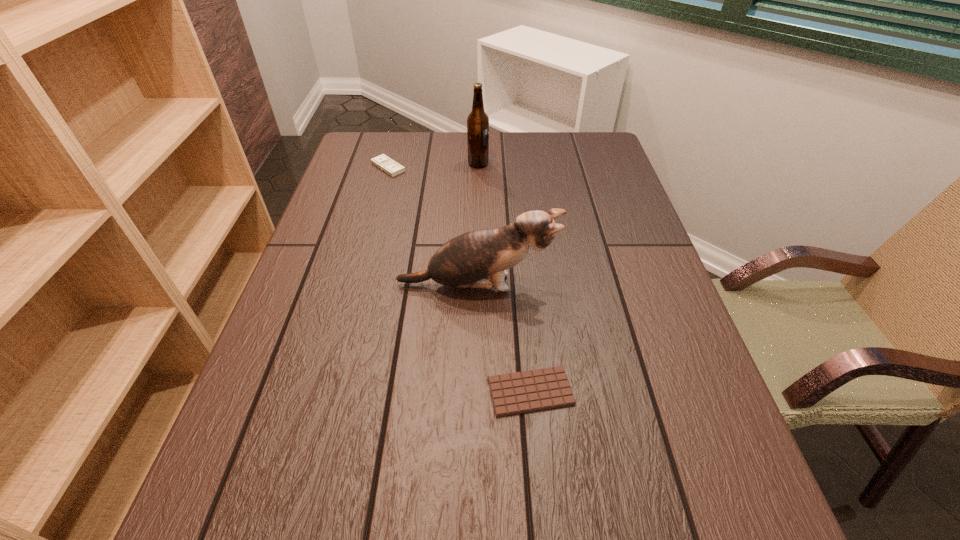
Find the location of `the tallest object`. the tallest object is located at coordinates (477, 121).

Where is `the second tallest object`? This screenshot has width=960, height=540. the second tallest object is located at coordinates (462, 262).

Image resolution: width=960 pixels, height=540 pixels. Find the location of `cat`. cat is located at coordinates (462, 262).

Where is `the second shortest object`? The height and width of the screenshot is (540, 960). the second shortest object is located at coordinates (383, 162).

I want to click on the leftmost object, so click(383, 162).

Where is `chocolate bar`? This screenshot has height=540, width=960. chocolate bar is located at coordinates [x=521, y=392].

The width and height of the screenshot is (960, 540). I want to click on the nearest object, so click(521, 392).

Image resolution: width=960 pixels, height=540 pixels. Find the location of `free region located on the label of the tallest object`. free region located on the label of the tallest object is located at coordinates (602, 164).

Identify the location of vacant space located 0.190m at the face of the cat. (642, 285).

Find the location of `vacant point located 0.290m on the right of the second shortest object`. vacant point located 0.290m on the right of the second shortest object is located at coordinates (502, 167).